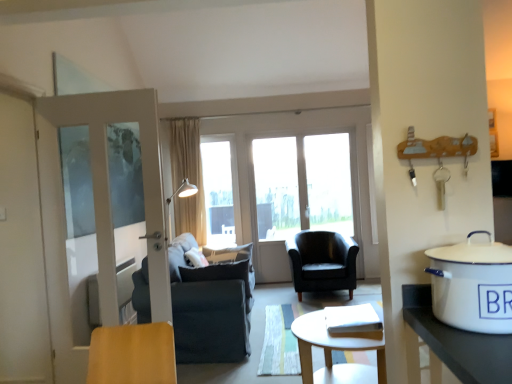
Where is `transparent glass window at center`? Image resolution: width=512 pixels, height=384 pixels. transparent glass window at center is located at coordinates (218, 192).

What is the approximate width of light wood coffee table at center?

The width of light wood coffee table at center is 62.64 centimeters.

Image resolution: width=512 pixels, height=384 pixels. Describe the element at coordinates (322, 262) in the screenshot. I see `black leather armchair at center, the second chair in the left-to-right sequence` at that location.

The image size is (512, 384). What are the coordinates of `white glossy screen door at left` in the screenshot? It's located at (22, 251).

Locate an element on the screen. Image resolution: width=512 pixels, height=384 pixels. screen door above the white enamel pot at right (from a real-world perspective) is located at coordinates (22, 251).

From the image's perspective, is white enamel pot at right above white glossy screen door at left?

Yes, from the image's perspective, white enamel pot at right is above white glossy screen door at left.

Can you confirm if white enamel pot at right is positioned to the right of white glossy screen door at left?

Yes.

In terms of width, does white enamel pot at right look wider or thinner when compared to white glossy screen door at left?

In the image, white enamel pot at right appears to be wider than white glossy screen door at left.

From a real-world perspective, who is located lower, white enamel pot at right or light wood coffee table at center?

In real-world perspective, light wood coffee table at center is lower.

Is white enamel pot at right placed right next to light wood coffee table at center?

No.

Can you confirm if white enamel pot at right is thinner than light wood coffee table at center?

Yes.

Is white enamel pot at right behind light wood coffee table at center?

No, white enamel pot at right is in front of light wood coffee table at center.

In the image, there is a white enamel pot at right. Where is `screen door below it (from the image's perspective)`? This screenshot has width=512, height=384. screen door below it (from the image's perspective) is located at coordinates tap(22, 251).

Considering the sizes of white glossy screen door at left and white enamel pot at right in the image, is white glossy screen door at left wider or thinner than white enamel pot at right?

white glossy screen door at left is thinner than white enamel pot at right.

Can you tell me how much white glossy screen door at left and white enamel pot at right differ in facing direction?

90.4 degrees.

Could you tell me if white glossy screen door at left is turned towards white enamel pot at right?

No, white glossy screen door at left is not turned towards white enamel pot at right.

Is dark gray fabric chair at center, the 2th chair viewed from the back, looking in the opposite direction of transparent glass window at center?

No, transparent glass window at center is not at the back of dark gray fabric chair at center, the 2th chair viewed from the back.

Find the location of a particular element. This screenshot has height=384, width=512. the 2nd chair below the transparent glass window at center (from the image's perspective) is located at coordinates (209, 308).

Is dark gray fabric chair at center, the 2th chair viewed from the back, in front of or behind transparent glass window at center in the image?

In the image, dark gray fabric chair at center, the 2th chair viewed from the back, appears in front of transparent glass window at center.

Does dark gray fabric chair at center, which ranks as the 1th chair in left-to-right order, have a greater width compared to transparent glass window at center?

Yes, dark gray fabric chair at center, which ranks as the 1th chair in left-to-right order, is wider than transparent glass window at center.

From a real-world perspective, between light wood coffee table at center and beige fabric curtain at center, who is vertically higher?

beige fabric curtain at center.

Which object is positioned more to the left, light wood coffee table at center or beige fabric curtain at center?

beige fabric curtain at center is more to the left.

Can beige fabric curtain at center be found inside light wood coffee table at center?

No.

Is the position of light wood coffee table at center less distant than that of beige fabric curtain at center?

Yes, the depth of light wood coffee table at center is less than that of beige fabric curtain at center.

Which is correct: white glossy screen door at left is inside transparent glass window at center, or outside of it?

white glossy screen door at left is not enclosed by transparent glass window at center.

Is white glossy screen door at left shorter than transparent glass window at center?

No.

In the scene shown: From the image's perspective, relative to transparent glass window at center, is white glossy screen door at left above or below?

Based on their image positions, white glossy screen door at left is located beneath transparent glass window at center.

Where is `window screen located above the white glossy screen door at left (from the image's perspective)`? The height and width of the screenshot is (384, 512). window screen located above the white glossy screen door at left (from the image's perspective) is located at coordinates (218, 192).

Which object is further away from the camera taking this photo, dark gray fabric chair at center, which ranks as the 1th chair in left-to-right order, or beige fabric curtain at center?

beige fabric curtain at center is more distant.

In terms of width, does dark gray fabric chair at center, placed as the second chair when sorted from right to left, look wider or thinner when compared to beige fabric curtain at center?

dark gray fabric chair at center, placed as the second chair when sorted from right to left, is wider than beige fabric curtain at center.

Is dark gray fabric chair at center, which ranks as the 1th chair in left-to-right order, shorter than beige fabric curtain at center?

Yes.

Consider the image. How many degrees apart are the facing directions of dark gray fabric chair at center, the 2th chair viewed from the back, and beige fabric curtain at center?

92.6 degrees.

This screenshot has height=384, width=512. Identify the location of cooker in front of the white glossy screen door at left. (472, 285).

Image resolution: width=512 pixels, height=384 pixels. In order to click on coffee table below the white enamel pot at right (from the image's perspective) in this screenshot , I will do `click(337, 349)`.

Looking at the image, which one is located further to light wood coffee table at center, dark gray fabric chair at center, placed as the second chair when sorted from right to left, or white glossy screen door at left?

white glossy screen door at left is positioned further to the anchor light wood coffee table at center.

Estimate the real-world distances between objects in this image. Which object is further from black leather armchair at center, marked as the 2th chair in a front-to-back arrangement, white enamel pot at right or dark gray fabric chair at center, the 1th chair when ordered from front to back?

white enamel pot at right is further to black leather armchair at center, marked as the 2th chair in a front-to-back arrangement.

Considering their positions, is white glossy screen door at left positioned closer to beige fabric curtain at center than light wood coffee table at center?

white glossy screen door at left is positioned closer to the anchor beige fabric curtain at center.

From the image, which object appears to be farther from white enamel pot at right, light wood coffee table at center or transparent glass window at center?

transparent glass window at center is positioned further to the anchor white enamel pot at right.

Which object lies further to the anchor point transparent glass window at center, light wood coffee table at center or beige fabric curtain at center?

light wood coffee table at center lies further to transparent glass window at center than the other object.

Estimate the real-world distances between objects in this image. Which object is closer to beige fabric curtain at center, white glossy screen door at left or black leather armchair at center, the second chair in the left-to-right sequence?

The object closer to beige fabric curtain at center is black leather armchair at center, the second chair in the left-to-right sequence.

When comparing their distances from black leather armchair at center, the 1th chair in the right-to-left sequence, does beige fabric curtain at center or white glossy screen door at left seem further?

The object further to black leather armchair at center, the 1th chair in the right-to-left sequence, is white glossy screen door at left.

Consider the image. Which object lies nearer to the anchor point black leather armchair at center, the second chair in the left-to-right sequence, light wood coffee table at center or dark gray fabric chair at center, which ranks as the 1th chair in left-to-right order?

dark gray fabric chair at center, which ranks as the 1th chair in left-to-right order.

Identify the location of chair between dark gray fabric chair at center, the 2th chair viewed from the back, and transparent glass window at center, along the z-axis. click(322, 262).

I want to click on screen door between light wood coffee table at center and black leather armchair at center, marked as the 2th chair in a front-to-back arrangement, in the front-back direction, so pyautogui.click(x=22, y=251).

I want to click on screen door between white enamel pot at right and black leather armchair at center, marked as the 1th chair in a back-to-front arrangement, in the front-back direction, so click(x=22, y=251).

Find the location of `coffee table between white glossy screen door at left and white enamel pot at right`. coffee table between white glossy screen door at left and white enamel pot at right is located at coordinates (337, 349).